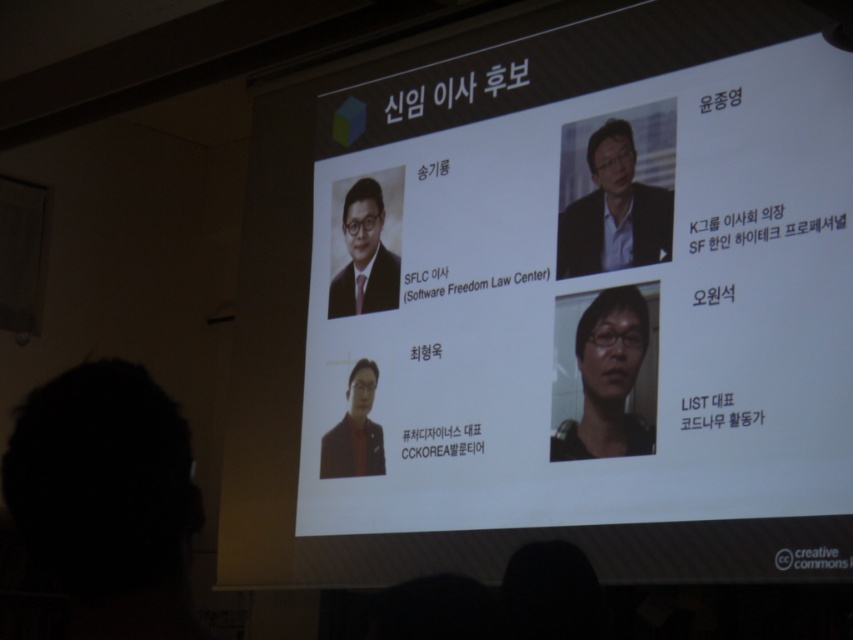
Which is above, matte black suit at upper right or matte black glasses at center?

matte black suit at upper right is higher up.

Is matte black suit at upper right closer to camera compared to matte black glasses at center?

No, it is not.

Is point (625, 241) positioned after point (595, 300)?

No, (625, 241) is closer to viewer.

The image size is (853, 640). Identify the location of matte black suit at upper right. (614, 211).

Is matte black suit at upper right behind matte black suit at center?

No, matte black suit at upper right is in front of matte black suit at center.

Which is more to the left, matte black suit at upper right or matte black suit at center?

From the viewer's perspective, matte black suit at center appears more on the left side.

Is point (602, 195) behind point (350, 394)?

No, (602, 195) is in front of (350, 394).

In order to click on matte black suit at upper right in this screenshot , I will do `click(614, 211)`.

Does matte black laptop at upper center have a smaller size compared to matte black suit at center?

No.

Between point (445, 525) and point (367, 474), which one is positioned in front?

Point (445, 525) is more forward.

Image resolution: width=853 pixels, height=640 pixels. Find the location of `matte black laptop at upper center`. matte black laptop at upper center is located at coordinates (598, 300).